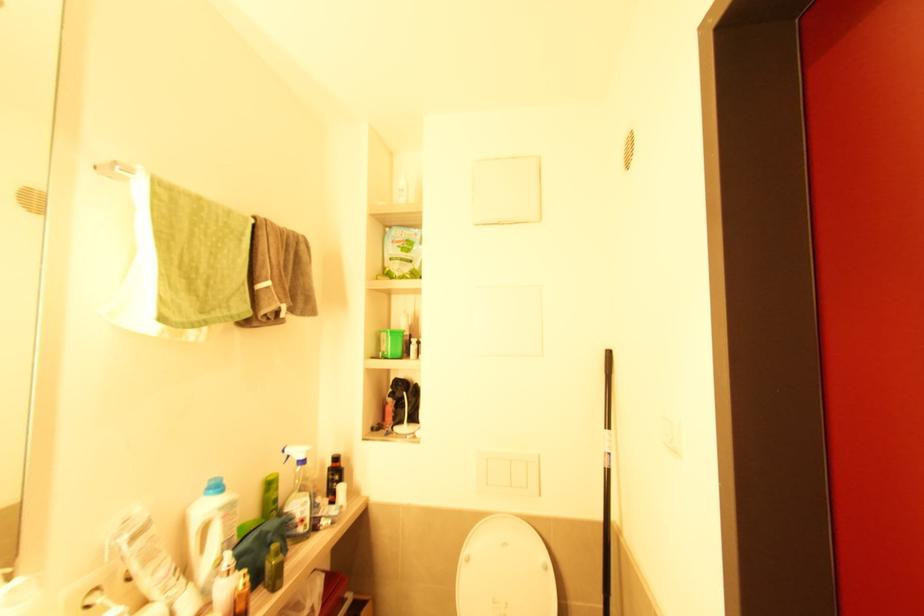
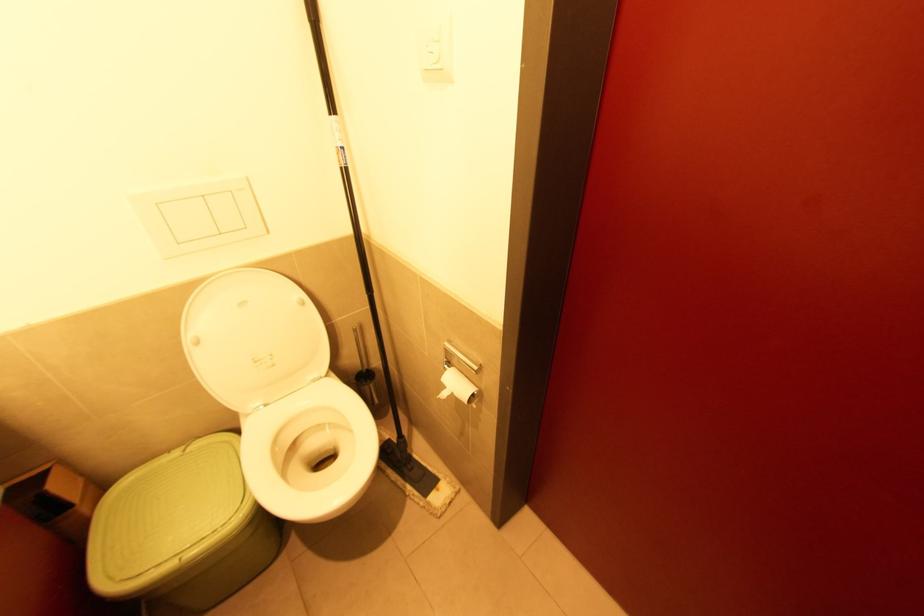
Locate, in the second image, the point that corresponds to the point at 610,472 in the first image.

(347, 172)